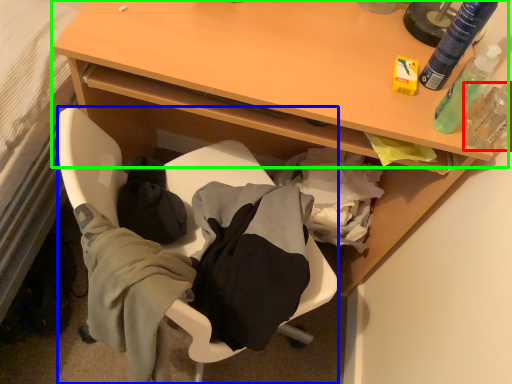
Question: Which object is positioned farthest from toiletry (highlighted by a red box)? Select from chair (highlighted by a blue box) and table (highlighted by a green box).

Choices:
 (A) chair
 (B) table

Answer: (A)